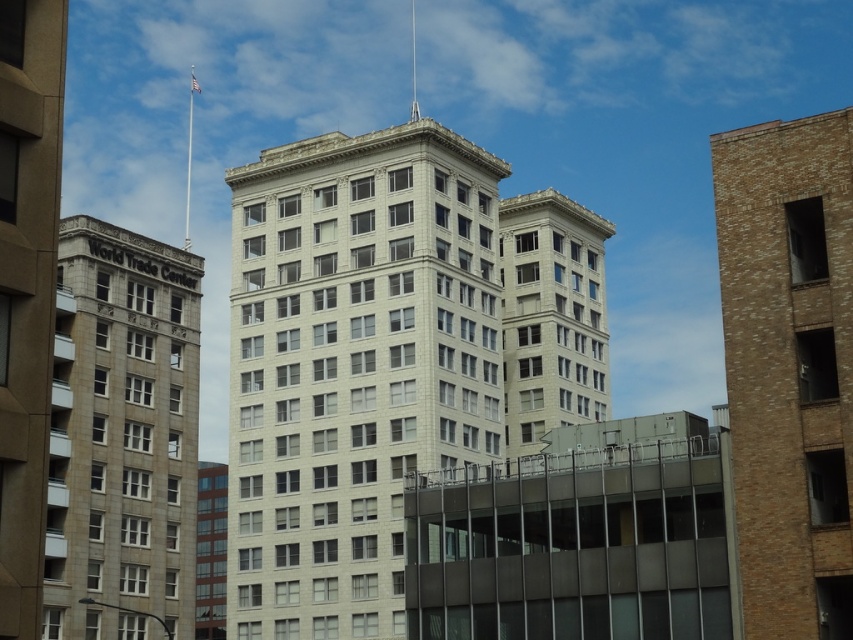
You are an urban planner assessing the layout of this city block. You need to determine which building between the brown brick building at right and the white stone building at center has a wider footprint. Based on the provided information, which one is wider?

The white stone building at center has a wider footprint than the brown brick building at right as its width is greater according to the description.

You are standing on the sidewalk in front of the cityscape. You see the brown brick building at right and the white stone building at center. Which building appears larger to you?

The brown brick building at right appears larger because it is closer to the viewer than the white stone building at center.

You are a city planner analyzing a map of the urban layout. You need to place a new public park in an area that is not occupied by the brown brick building at right. Where should you avoid placing the park?

The brown brick building at right is located at point [788,368], so the park should be placed away from that coordinate to avoid overlapping with the building.